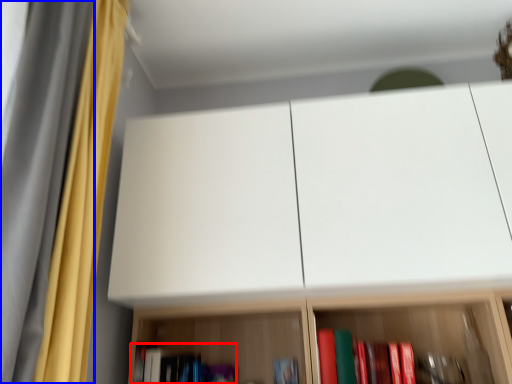
Question: Which object appears closest to the camera in this image, book (highlighted by a red box) or curtain (highlighted by a blue box)?

Choices:
 (A) book
 (B) curtain

Answer: (B)